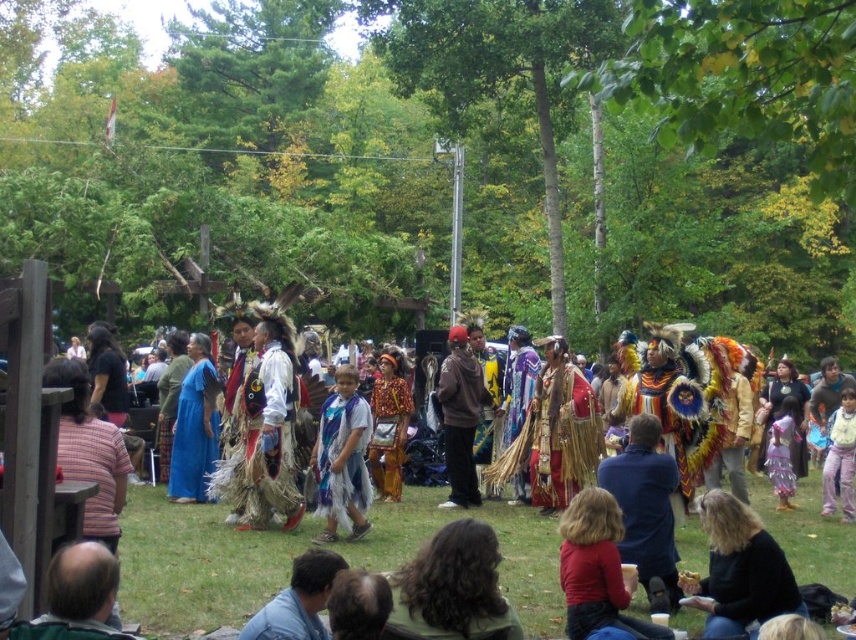
Question: Considering the relative positions of shiny metallic headdress at center and brown suede jacket at center in the image provided, where is shiny metallic headdress at center located with respect to brown suede jacket at center?

Choices:
 (A) right
 (B) left

Answer: (A)

Question: Does black leather jacket at lower right have a smaller size compared to brown suede jacket at center?

Choices:
 (A) yes
 (B) no

Answer: (A)

Question: Which object is closer to the camera taking this photo?

Choices:
 (A) brown suede jacket at center
 (B) shiny metallic headdress at center

Answer: (B)

Question: Is black leather jacket at lower right to the right of blue feathered headdress at center from the viewer's perspective?

Choices:
 (A) no
 (B) yes

Answer: (B)

Question: Which point appears closest to the camera in this image?

Choices:
 (A) [456, 352]
 (B) [324, 483]

Answer: (B)

Question: Which of the following is the closest to the observer?

Choices:
 (A) (736, 561)
 (B) (465, 483)
 (C) (342, 419)

Answer: (A)